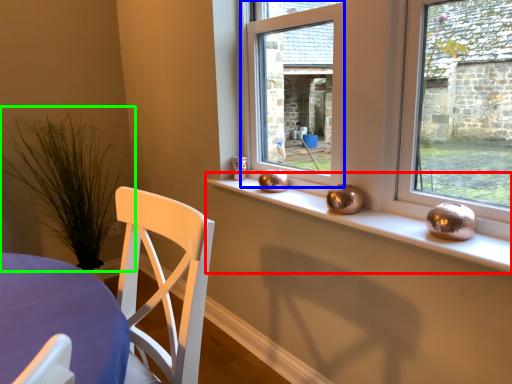
Question: Estimate the real-world distances between objects in this image. Which object is closer to window sill (highlighted by a red box), window (highlighted by a blue box) or plant (highlighted by a green box)?

Choices:
 (A) window
 (B) plant

Answer: (A)